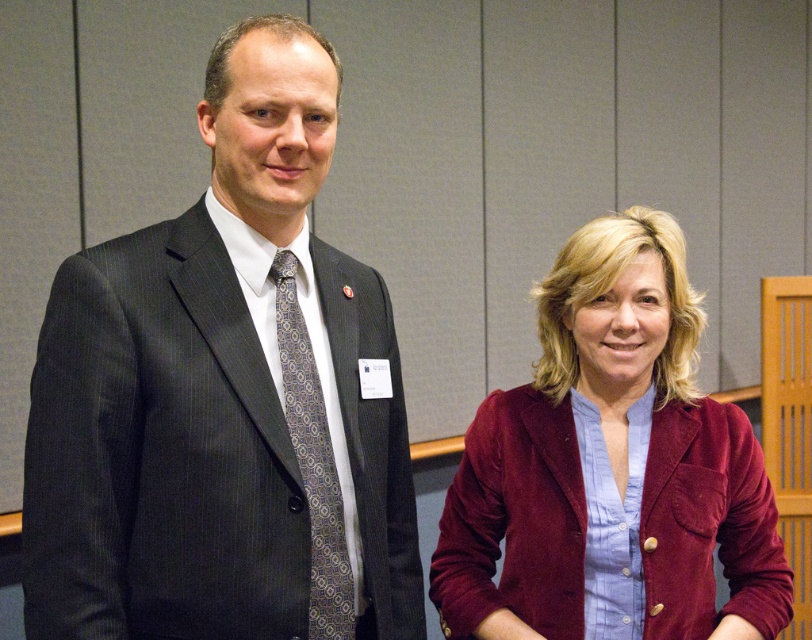
You are standing at the origin point in the image. Which direction should you move to reach the matte black suit at left?

The matte black suit at left is located at coordinates point (223, 397), so you should move towards the right and upwards to reach it.